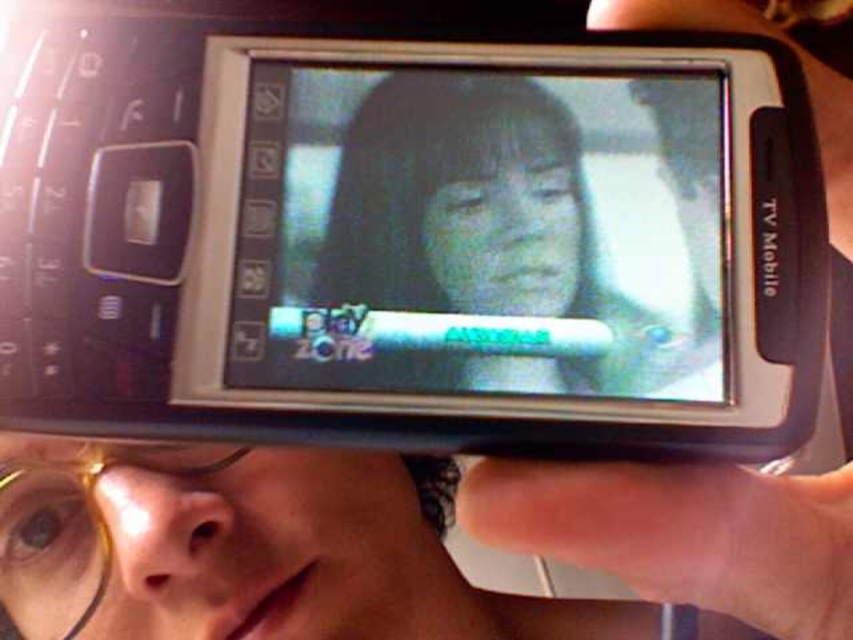
Question: Does smooth skin hand at center have a greater width compared to gold plastic glasses at lower left?

Choices:
 (A) yes
 (B) no

Answer: (A)

Question: Which point is closer to the camera taking this photo?

Choices:
 (A) (93, 554)
 (B) (840, 522)

Answer: (B)

Question: Is smooth skin face at center thinner than gold plastic glasses at lower left?

Choices:
 (A) yes
 (B) no

Answer: (A)

Question: Which point is farther to the camera?

Choices:
 (A) (521, 298)
 (B) (102, 547)

Answer: (B)

Question: Is smooth skin hand at center to the left of gold plastic glasses at lower left from the viewer's perspective?

Choices:
 (A) yes
 (B) no

Answer: (B)

Question: Which of the following is the farthest from the observer?

Choices:
 (A) (361, 148)
 (B) (44, 586)

Answer: (B)